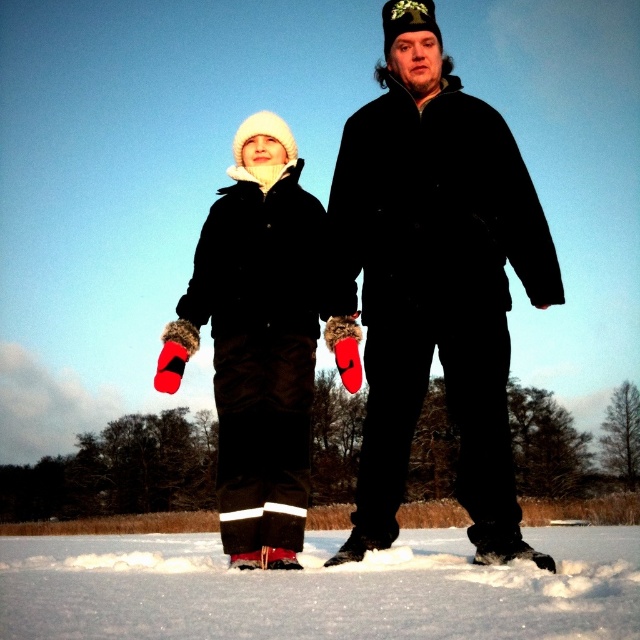
Is matte black coat at center positioned behind white fluffy snow at lower center?

Yes, it is.

Measure the distance between matte black coat at center and white fluffy snow at lower center.

matte black coat at center is 10.92 meters away from white fluffy snow at lower center.

The height and width of the screenshot is (640, 640). Identify the location of matte black coat at center. (433, 280).

The height and width of the screenshot is (640, 640). I want to click on matte black coat at center, so click(433, 280).

Is point (346, 141) positioned behind point (248, 518)?

Yes, it is behind point (248, 518).

Between point (512, 461) and point (189, 333), which one is positioned in front?

Positioned in front is point (512, 461).

Locate an element on the screen. matte black coat at center is located at coordinates (433, 280).

Consider the image. Does white fluffy snow at lower center have a lesser height compared to fuzzy red mittens at left?

Incorrect, white fluffy snow at lower center's height does not fall short of fuzzy red mittens at left's.

Is point (316, 589) more distant than point (300, 387)?

That is False.

The width and height of the screenshot is (640, 640). Find the location of `white fluffy snow at lower center`. white fluffy snow at lower center is located at coordinates (317, 588).